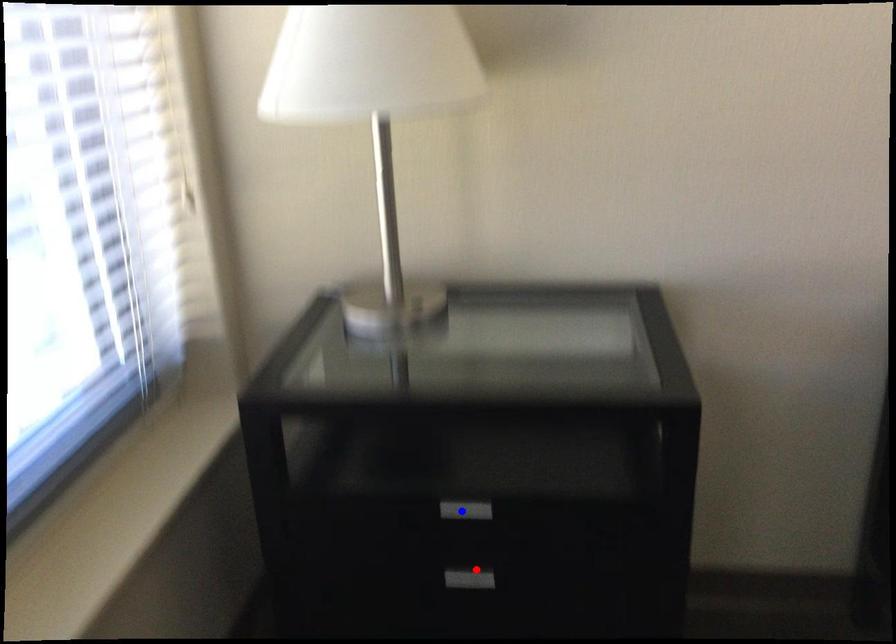
Question: In the image, two points are highlighted. Which point is nearer to the camera? Reply with the corresponding letter.

Choices:
 (A) blue point
 (B) red point

Answer: (A)